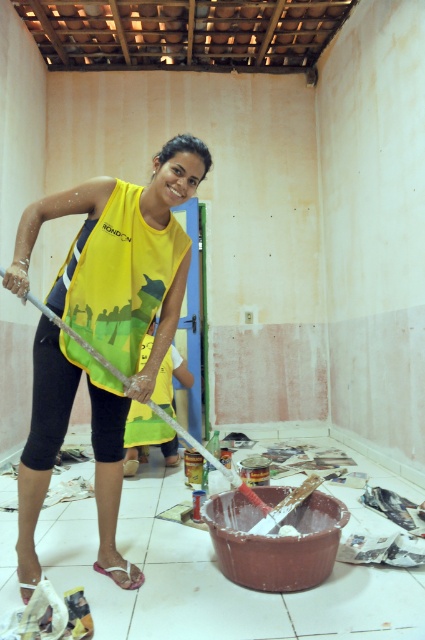
Question: Does yellow fabric at center appear over white plastic shovel at center?

Choices:
 (A) yes
 (B) no

Answer: (A)

Question: Which point is farther to the camera?

Choices:
 (A) (76, 336)
 (B) (164, 193)

Answer: (B)

Question: Is yellow fabric at center thinner than white plastic shovel at center?

Choices:
 (A) no
 (B) yes

Answer: (B)

Question: Is yellow fabric at center bigger than white plastic shovel at center?

Choices:
 (A) no
 (B) yes

Answer: (A)